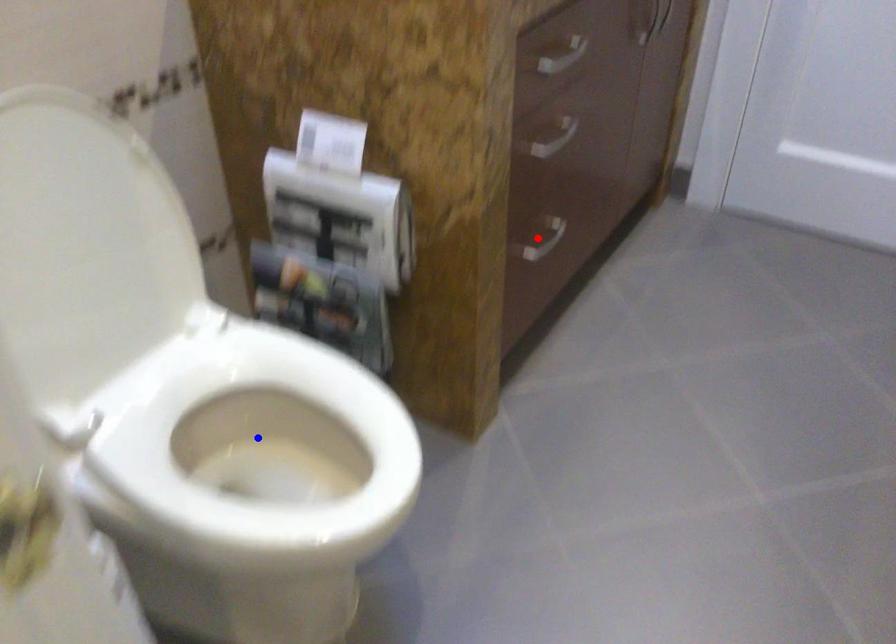
Question: In the image, two points are highlighted. Which point is nearer to the camera? Reply with the corresponding letter.

Choices:
 (A) blue point
 (B) red point

Answer: (A)